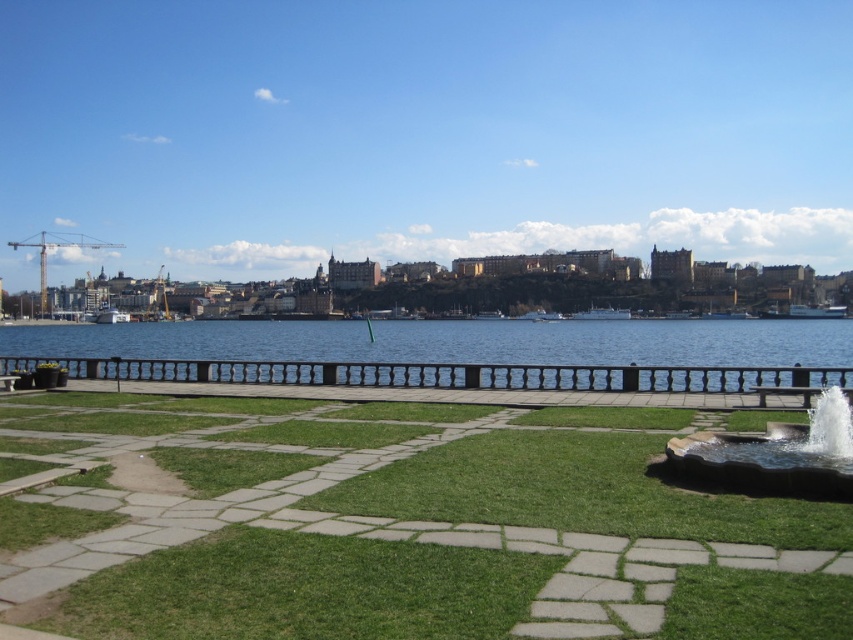
Between point (601, 388) and point (711, 476), which one is positioned in front?

Positioned in front is point (711, 476).

Can you confirm if blue water at center is shorter than smooth stone fountain at lower right?

No.

Is point (521, 365) positioned after point (755, 483)?

Yes, point (521, 365) is behind point (755, 483).

The height and width of the screenshot is (640, 853). What are the coordinates of `blue water at center` in the screenshot? It's located at (451, 353).

Who is taller, green grass at center or blue water at center?

blue water at center

Does point (86, 536) come closer to viewer compared to point (28, 368)?

Yes, point (86, 536) is in front of point (28, 368).

Which is in front, point (605, 490) or point (357, 385)?

Point (605, 490) is in front.

I want to click on green grass at center, so click(x=397, y=525).

Can you confirm if green grass at center is taller than smooth stone fountain at lower right?

Indeed, green grass at center has a greater height compared to smooth stone fountain at lower right.

Does point (334, 552) come closer to viewer compared to point (822, 406)?

That is True.

Does point (550, 515) lie in front of point (772, 444)?

Yes, it is in front of point (772, 444).

The width and height of the screenshot is (853, 640). In order to click on green grass at center in this screenshot , I will do tap(397, 525).